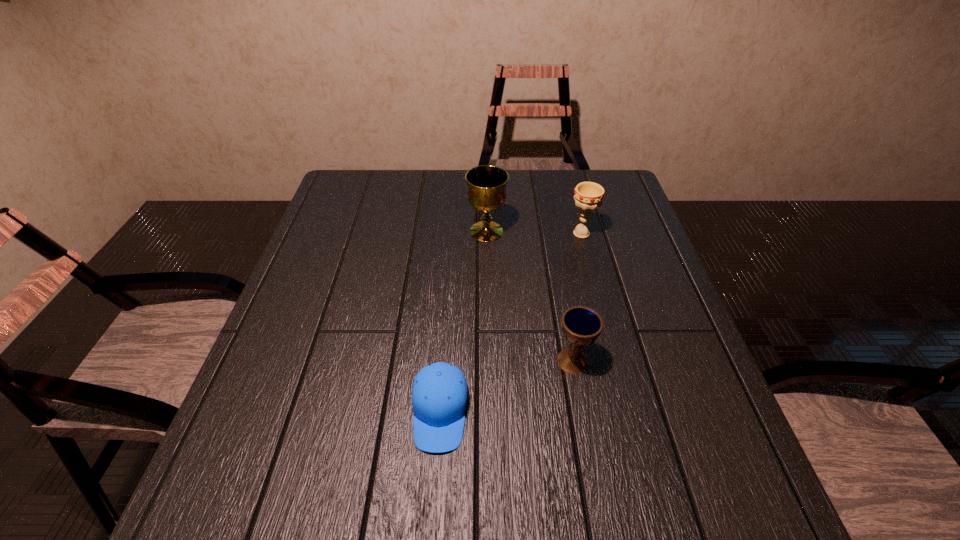
Where is `object that is at the right edge`? The width and height of the screenshot is (960, 540). object that is at the right edge is located at coordinates (588, 196).

At what (x,y) coordinates should I click in order to perform the action: click on free space at the far edge. Please return your answer as a coordinate pair (x, y). Image resolution: width=960 pixels, height=540 pixels. Looking at the image, I should click on point(509,190).

Identify the location of vacant area at the near edge of the desktop. Image resolution: width=960 pixels, height=540 pixels. (389, 534).

Image resolution: width=960 pixels, height=540 pixels. I want to click on free space at the left edge, so click(352, 231).

Identify the location of free spot at the right edge of the desktop. The height and width of the screenshot is (540, 960). (618, 237).

At what (x,y) coordinates should I click in order to perform the action: click on blank region between the tallest object and the second object from right to left. Please return your answer as a coordinate pair (x, y). This screenshot has height=540, width=960. Looking at the image, I should click on (530, 296).

Where is `vacant region between the leftmost chalice and the rightmost chalice`? vacant region between the leftmost chalice and the rightmost chalice is located at coordinates (534, 232).

This screenshot has height=540, width=960. Find the location of `free space between the tallest chalice and the shortest object`. free space between the tallest chalice and the shortest object is located at coordinates (463, 322).

Locate an element on the screen. The height and width of the screenshot is (540, 960). empty space between the second object from right to left and the cap is located at coordinates tap(507, 386).

Identify the location of free area in between the cap and the leftmost chalice. The width and height of the screenshot is (960, 540). (463, 322).